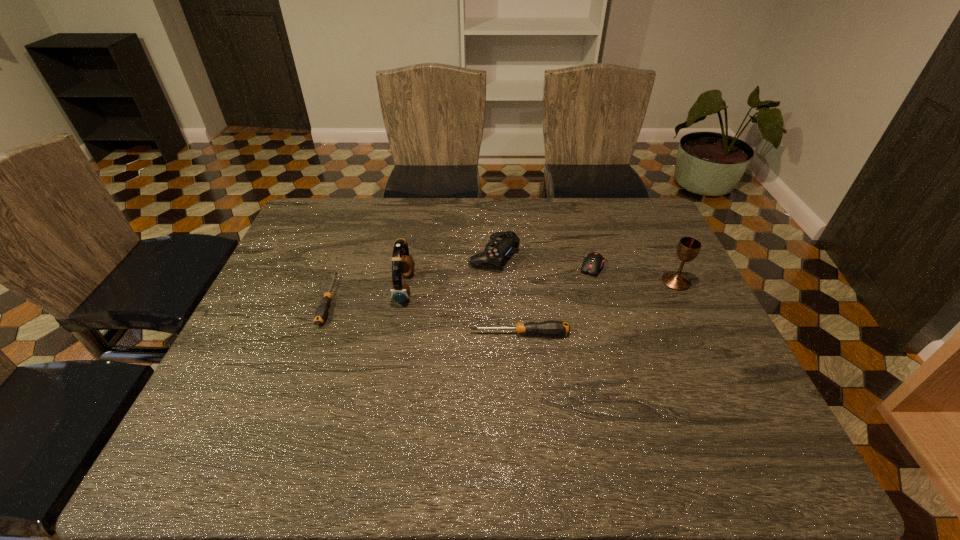
At what (x,y) coordinates should I click in order to perform the action: click on blank area in the image that satisfies the following two spatial constraints: 1. on the back side of the leftmost object; 2. on the left side of the computer mouse. Please return your answer as a coordinate pair (x, y). Looking at the image, I should click on point(341,267).

Locate an element on the screen. free location that satisfies the following two spatial constraints: 1. on the front side of the left screwdriver; 2. on the right side of the right screwdriver is located at coordinates (317, 334).

You are a GUI agent. You are given a task and a screenshot of the screen. Output one action in this format:
    pyautogui.click(x=<x>, y=<y>)
    Task: Click on the vacant space that satisfies the following two spatial constraints: 1. on the front side of the taller screwdriver; 2. on the left side of the control
    
    Given the screenshot: What is the action you would take?
    pyautogui.click(x=497, y=334)

I want to click on free space that satisfies the following two spatial constraints: 1. on the front side of the chalice; 2. on the right side of the computer mouse, so click(596, 281).